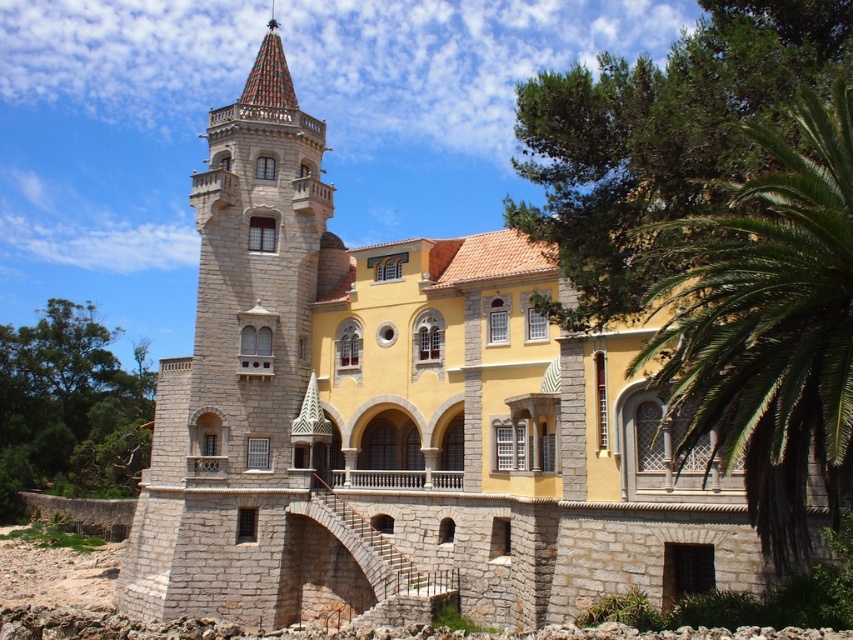
You are standing in front of the grand building and want to walk towards the stone tower at center and the green leafy palm at right. Which object will you reach first?

You will reach the stone tower at center first because it is closer to you than the green leafy palm at right, which is further away.

You are a tourist standing in front of the grand building. You notice both the stone tower at center and the green leafy palm at right. Which one appears taller from your vantage point?

The stone tower at center appears taller than the green leafy palm at right because it has a greater height compared to it.

You are an architect evaluating the proportions of the building. Given that the stone tower at center and the green leafy palm at right are both visible in the scene, which object has a greater width?

The stone tower at center has a greater width than the green leafy palm at right, as stated in the description that the stone tower at center surpasses the palm in width.